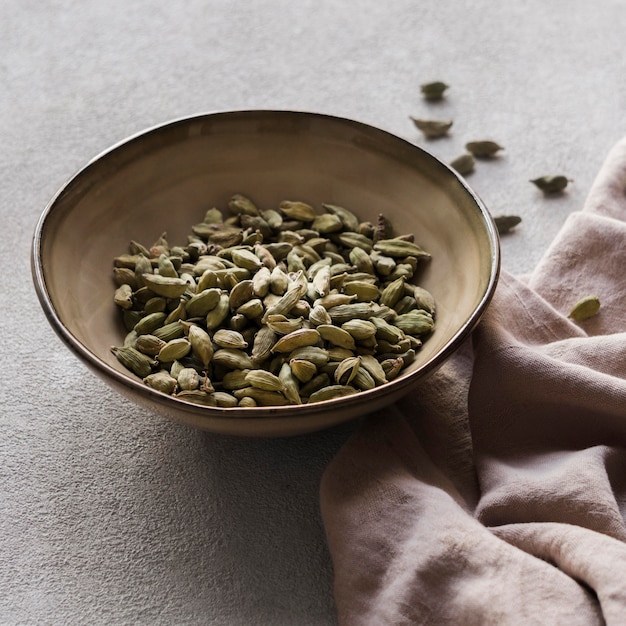
In order to click on gray fabric in this screenshot , I will do `click(516, 588)`, `click(423, 524)`, `click(587, 552)`.